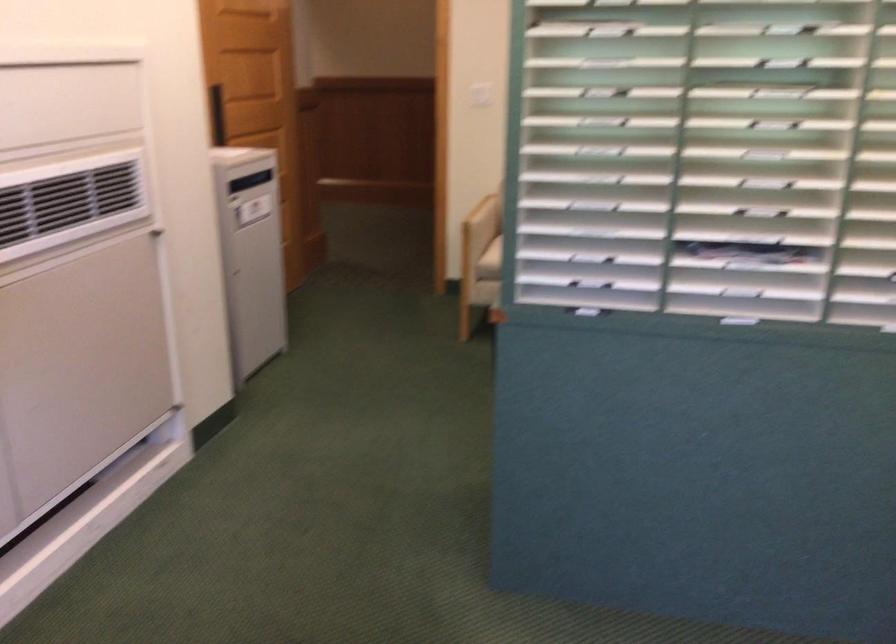
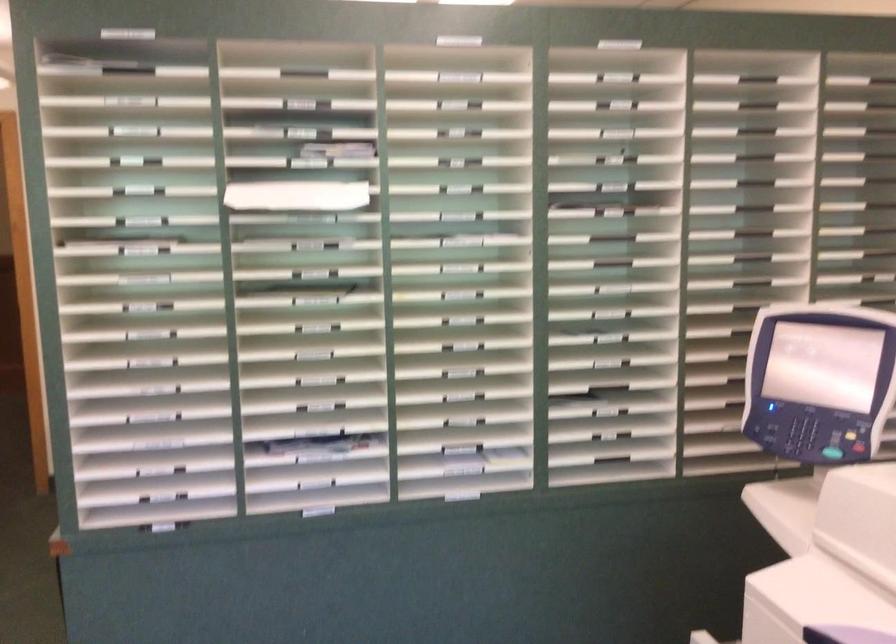
Question: The camera is either moving clockwise (left) or counter-clockwise (right) around the object. The first image is from the beginning of the video and the second image is from the end. Is the camera moving left or right when shooting the video?

Choices:
 (A) Left
 (B) Right

Answer: (A)